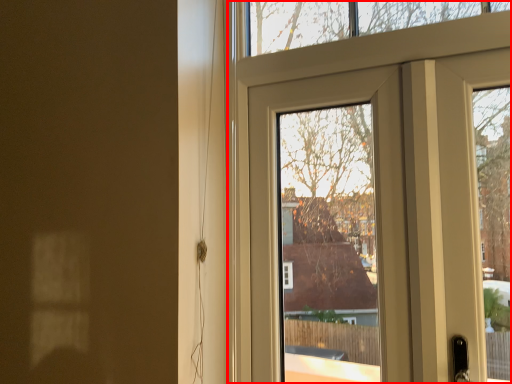
Question: Observing the image, what is the correct spatial positioning of door (annotated by the red box) in reference to door?

Choices:
 (A) right
 (B) left

Answer: (A)